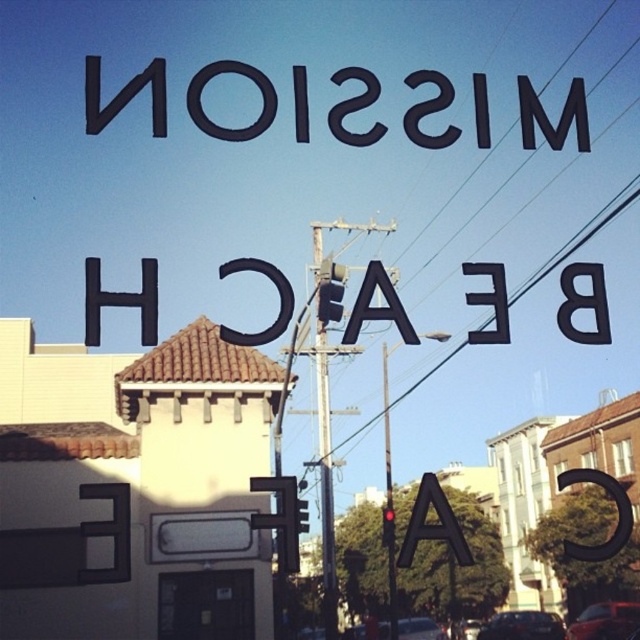
Question: Is metallic gray pole at center positioned before metallic wire at center?

Choices:
 (A) yes
 (B) no

Answer: (B)

Question: Considering the real-world distances, which object is farthest from the black matte sign at upper center?

Choices:
 (A) metallic wire at center
 (B) metallic gray pole at center
 (C) black matte letter a at center

Answer: (C)

Question: Can you confirm if metallic gray pole at center is wider than black matte letter a at center?

Choices:
 (A) no
 (B) yes

Answer: (A)

Question: Which point is farther to the camera?

Choices:
 (A) metallic wire at center
 (B) black matte sign at upper center

Answer: (A)

Question: Is the position of metallic gray pole at center more distant than that of metallic wire at center?

Choices:
 (A) yes
 (B) no

Answer: (A)

Question: Which object appears closest to the camera in this image?

Choices:
 (A) metallic wire at center
 (B) black matte sign at upper center

Answer: (B)